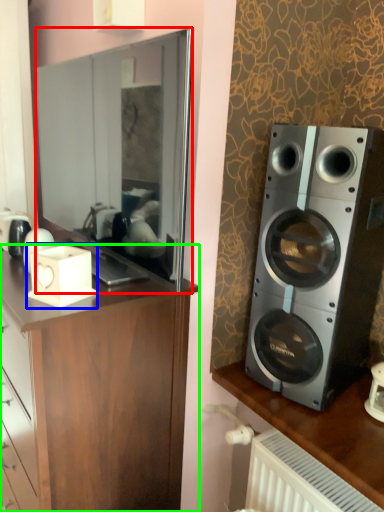
Question: Which object is positioned closest to mirror (highlighted by a red box)? Select from appliance (highlighted by a blue box) and cabinetry (highlighted by a green box).

Choices:
 (A) appliance
 (B) cabinetry

Answer: (A)